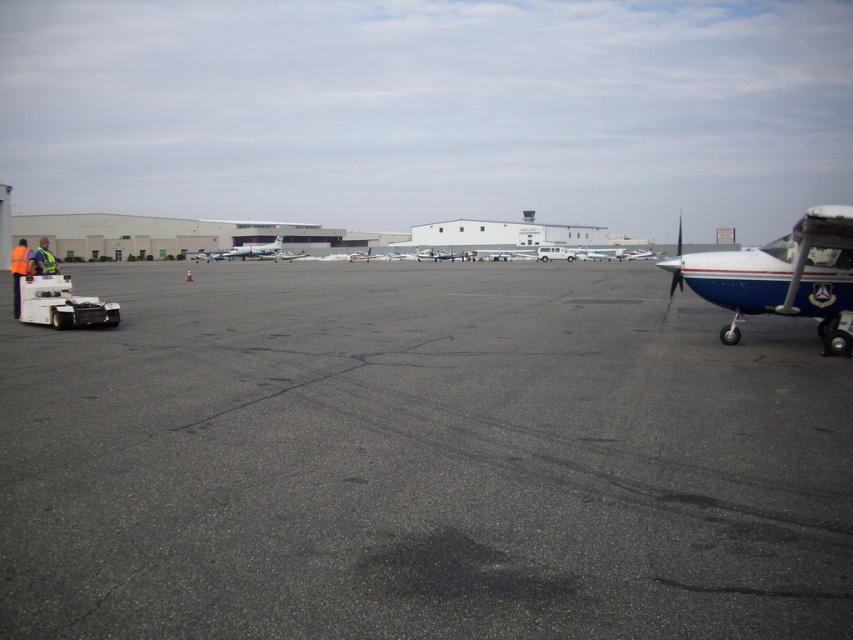
Is point (233, 248) closer to viewer compared to point (32, 266)?

No, it is not.

Can you confirm if silver metallic airplane at center is thinner than reflective yellow vest at left?

Yes, silver metallic airplane at center is thinner than reflective yellow vest at left.

Measure the distance between point (x=239, y=252) and camera.

Point (x=239, y=252) is 290.81 feet from camera.

I want to click on silver metallic airplane at center, so click(x=242, y=250).

The image size is (853, 640). I want to click on reflective yellow vest at left, so click(44, 259).

Does reflective yellow vest at left have a lesser width compared to white glossy airplane at center?

Incorrect, reflective yellow vest at left's width is not less than white glossy airplane at center's.

Which is in front, point (44, 241) or point (294, 253)?

Point (44, 241) is more forward.

Locate an element on the screen. reflective yellow vest at left is located at coordinates (44, 259).

Which is above, blue polished airplane at right or silver metallic airplane at center?

silver metallic airplane at center

Measure the distance from blue polished airplane at right to silver metallic airplane at center.

They are 72.79 meters apart.

Between point (817, 332) and point (218, 256), which one is positioned behind?

The point (218, 256) is more distant.

I want to click on blue polished airplane at right, so click(782, 276).